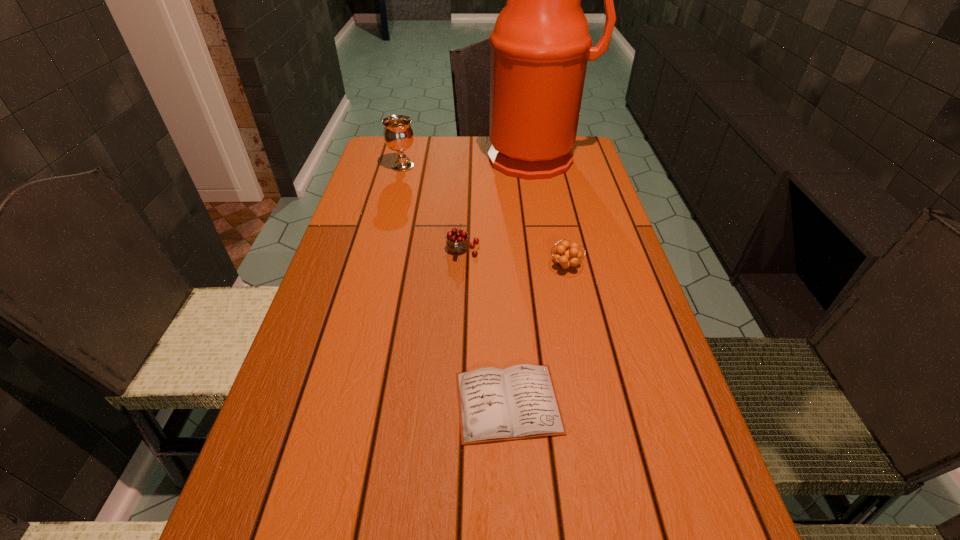
The width and height of the screenshot is (960, 540). In the image, there is a desktop. Identify the location of vacant space at the left edge. point(365,252).

Identify the location of free space at the right edge. Image resolution: width=960 pixels, height=540 pixels. (631, 350).

In the image, there is a desktop. Where is `vacant area at the far left corner`? This screenshot has height=540, width=960. vacant area at the far left corner is located at coordinates (376, 148).

Locate an element on the screen. vacant space at the far right corner is located at coordinates (577, 157).

This screenshot has width=960, height=540. I want to click on empty location between the water jug and the third shortest object, so click(x=500, y=205).

You are a GUI agent. You are given a task and a screenshot of the screen. Output one action in this format:
    pyautogui.click(x=<x>, y=<y>)
    Task: Click on the free spot between the third tallest object and the diary
    
    Given the screenshot: What is the action you would take?
    pyautogui.click(x=486, y=327)

At what (x,y) coordinates should I click in order to perform the action: click on vacant space in between the second tallest object and the third shortest object. Please return your answer as a coordinate pair (x, y). This screenshot has width=960, height=540. Looking at the image, I should click on (433, 208).

Identify the location of free point between the third tallest object and the orange fruit. This screenshot has height=540, width=960. 515,258.

Locate an element on the screen. This screenshot has height=540, width=960. blank region between the fourth tallest object and the cherry is located at coordinates (515, 258).

Locate an element on the screen. Image resolution: width=960 pixels, height=540 pixels. empty space that is in between the tallest object and the chalice is located at coordinates (470, 163).